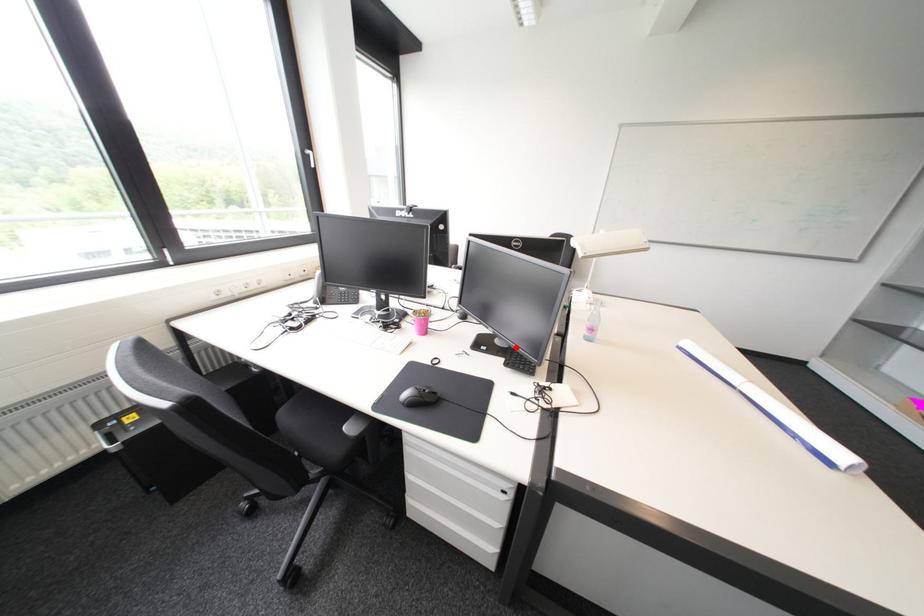
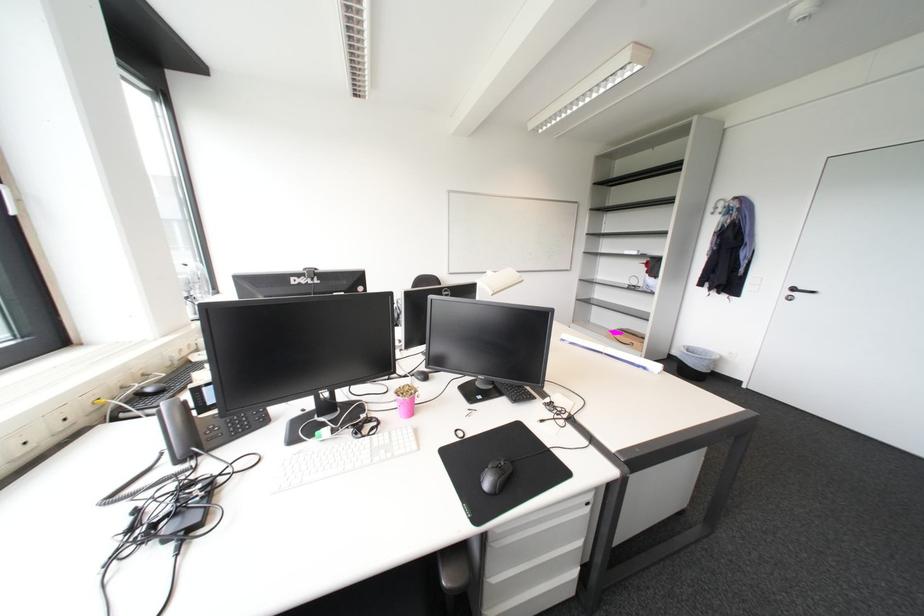
The point at the highlighted location is marked in the first image. Where is the corresponding point in the second image?

(502, 387)